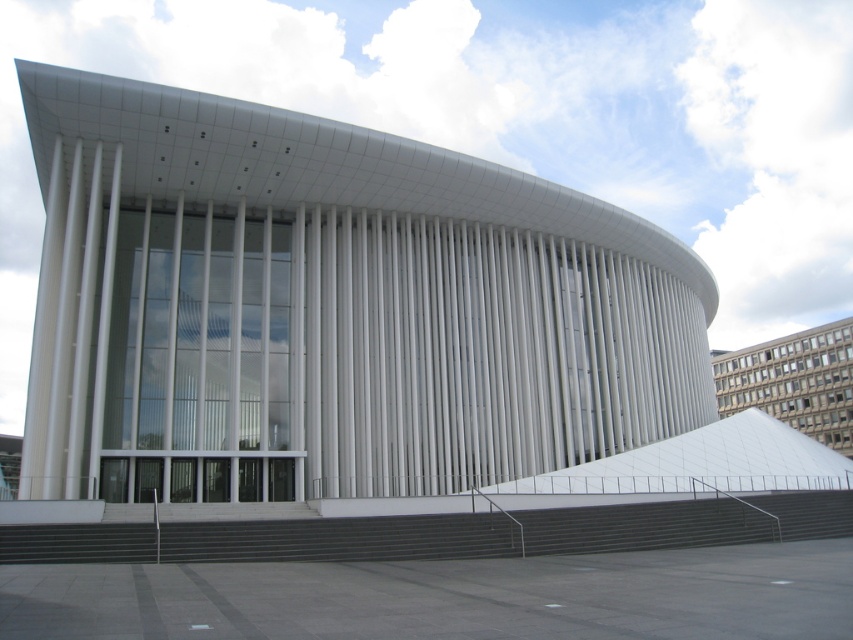
Looking at this image, you are standing at the entrance of the modern architectural structure and want to go down to the street level. Where are the dark gray concrete stairs at lower center located in relation to your current position?

The dark gray concrete stairs at lower center are located at point (514,531), which is to the lower center of the image, so they are directly in front of you at the entrance area.

You are standing at the entrance of the modern building and want to reach a specific point marked at coordinates point (234,157). If your maximum comfortable walking distance is 100 feet, will you be able to reach it without feeling too tired?

The distance of point (234,157) from camera is 124.82 feet, which exceeds your maximum comfortable walking distance of 100 feet. Therefore, you may feel tired if you walk to point (234,157).

You are standing at the entrance of the white smooth building at center. What are the coordinates of the building?

The white smooth building at center is located at coordinates point (329, 307).